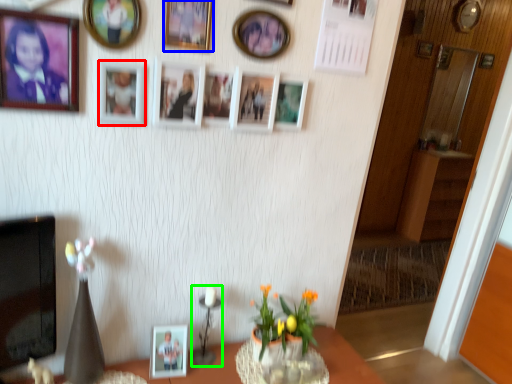
Question: Based on their relative distances, which object is farther from picture frame (highlighted by a red box)? Choose from picture frame (highlighted by a blue box) and candle holder (highlighted by a green box).

Choices:
 (A) picture frame
 (B) candle holder

Answer: (B)